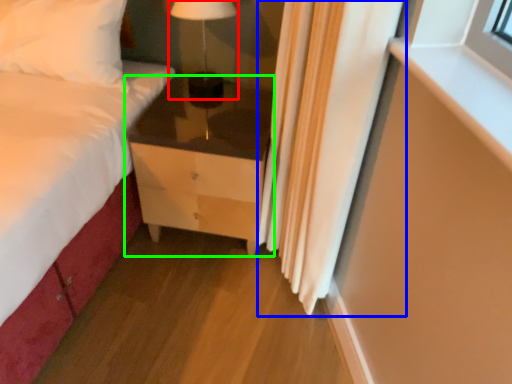
Question: Based on their relative distances, which object is nearer to table lamp (highlighted by a red box)? Choose from curtain (highlighted by a blue box) and chest of drawers (highlighted by a green box).

Choices:
 (A) curtain
 (B) chest of drawers

Answer: (B)